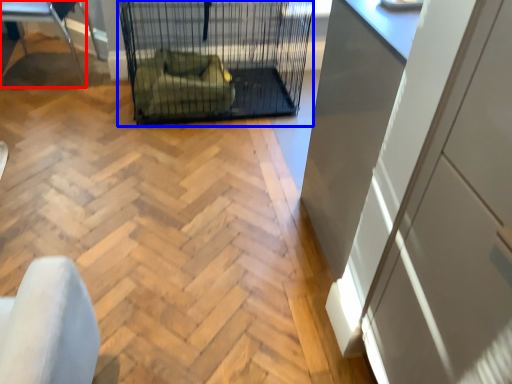
Question: Which object is further to the camera taking this photo, furniture (highlighted by a red box) or bird cage (highlighted by a blue box)?

Choices:
 (A) furniture
 (B) bird cage

Answer: (A)